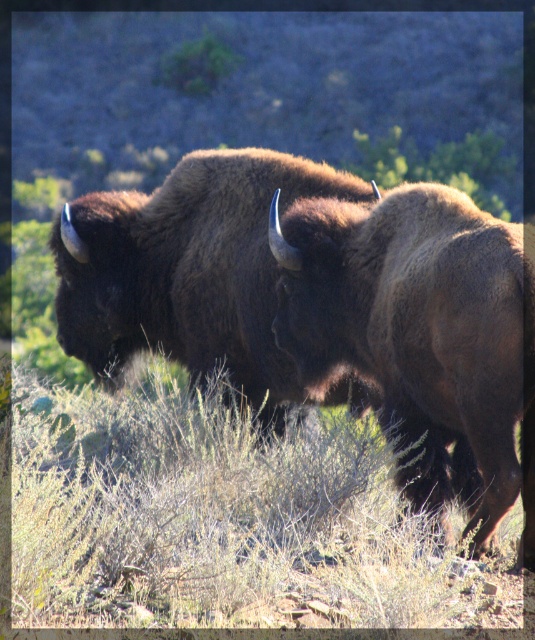
Which is above, dry grass at center or brown fuzzy bison at center?

Positioned higher is brown fuzzy bison at center.

Is dry grass at center smaller than brown fuzzy bison at center?

No.

Does point (216, 388) lie in front of point (159, 209)?

Yes.

Find the location of `dry grass at center`. dry grass at center is located at coordinates (223, 516).